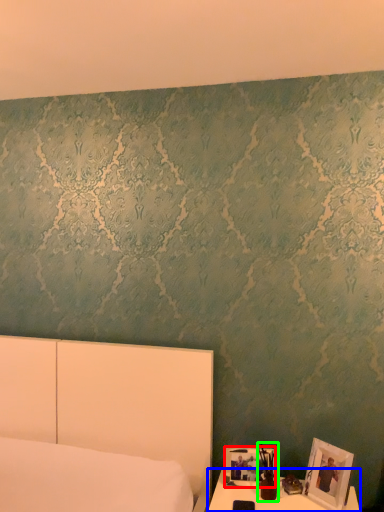
Question: Which object is positioned farthest from picture frame (highlighted by a red box)? Select from table (highlighted by a blue box) and bedside lamp (highlighted by a green box).

Choices:
 (A) table
 (B) bedside lamp

Answer: (A)